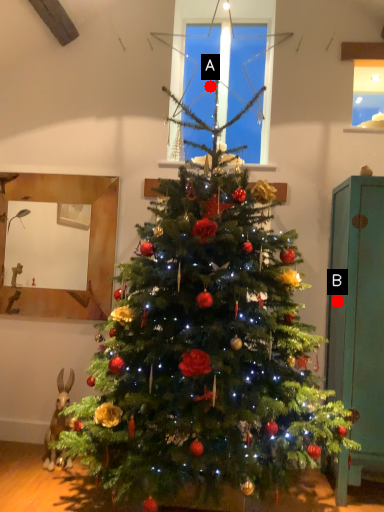
Question: Two points are circled on the image, labeled by A and B beside each circle. Which point is farther to the camera?

Choices:
 (A) A is further
 (B) B is further

Answer: (A)